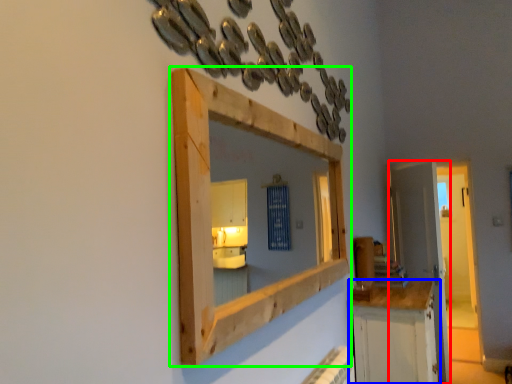
Question: Considering the real-world distances, which object is closest to door (highlighted by a red box)? cabinetry (highlighted by a blue box) or medicine cabinet (highlighted by a green box).

Choices:
 (A) cabinetry
 (B) medicine cabinet

Answer: (A)